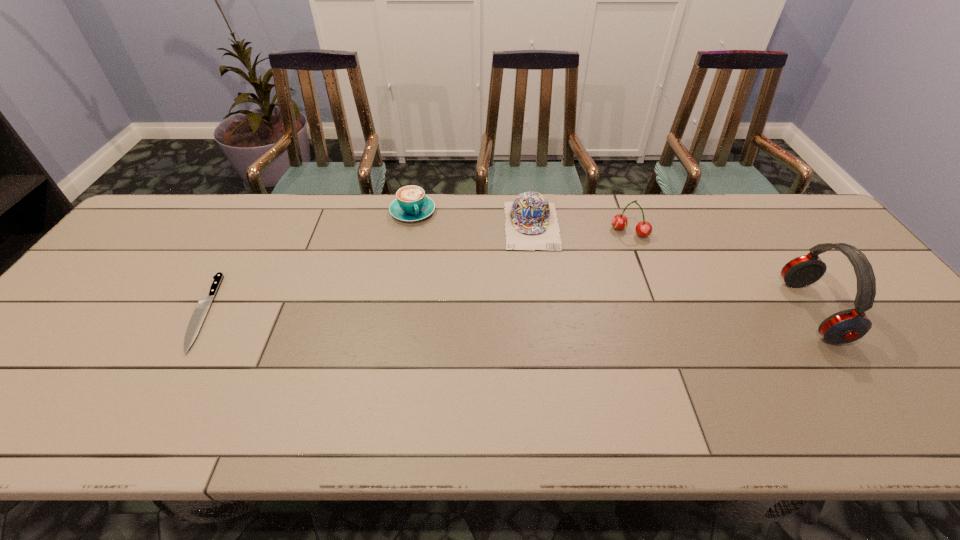
Identify the location of vacant spot on the desktop that is between the shortest object and the tallest object and is positioned with stems pointing upwards on the cherry. (588, 312).

Image resolution: width=960 pixels, height=540 pixels. Find the location of `free space on the desktop that is between the shortest object and the tallest object and is positioned with the handle on the right side of the second object from left to right`. free space on the desktop that is between the shortest object and the tallest object and is positioned with the handle on the right side of the second object from left to right is located at coordinates (462, 312).

Image resolution: width=960 pixels, height=540 pixels. I want to click on free spot on the desktop that is between the shortest object and the rightmost object and is positioned on the front, side, and top of the third object from left to right, so click(x=540, y=312).